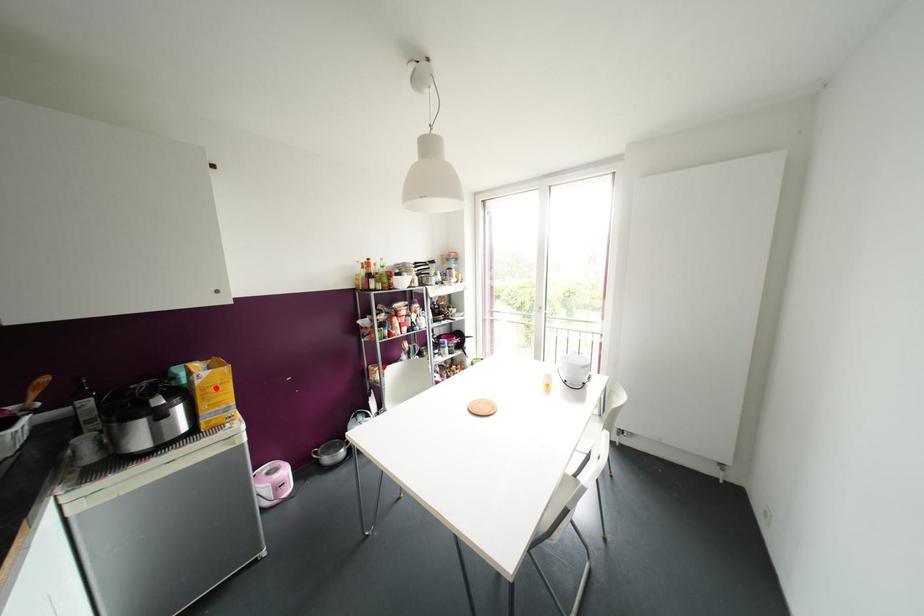
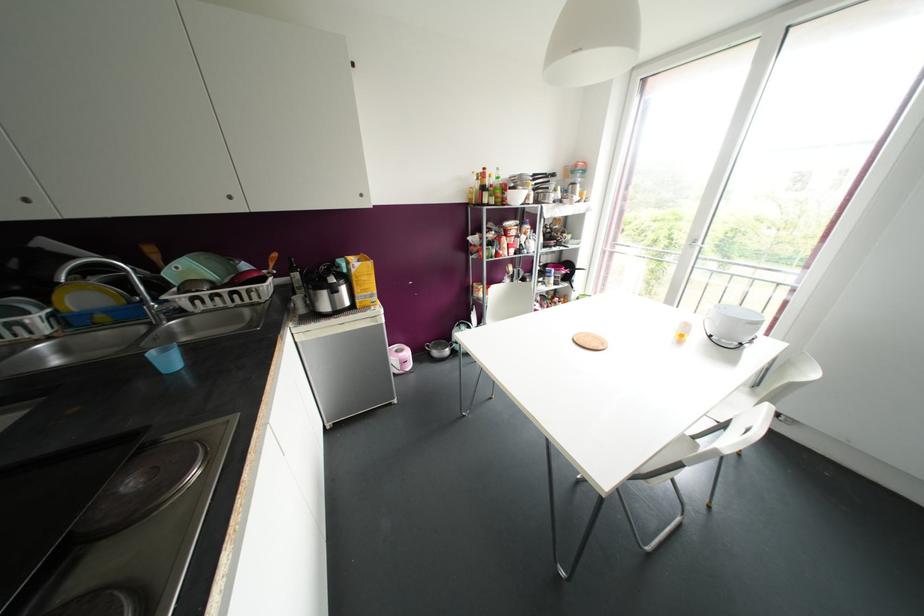
Locate, in the second image, the point that corresponds to the highlighted location in the first image.

(363, 277)